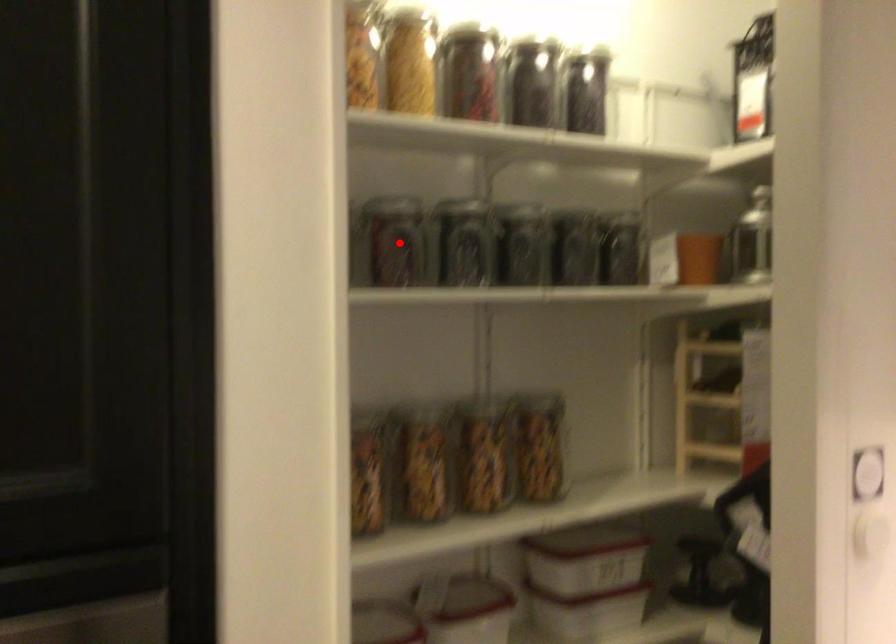
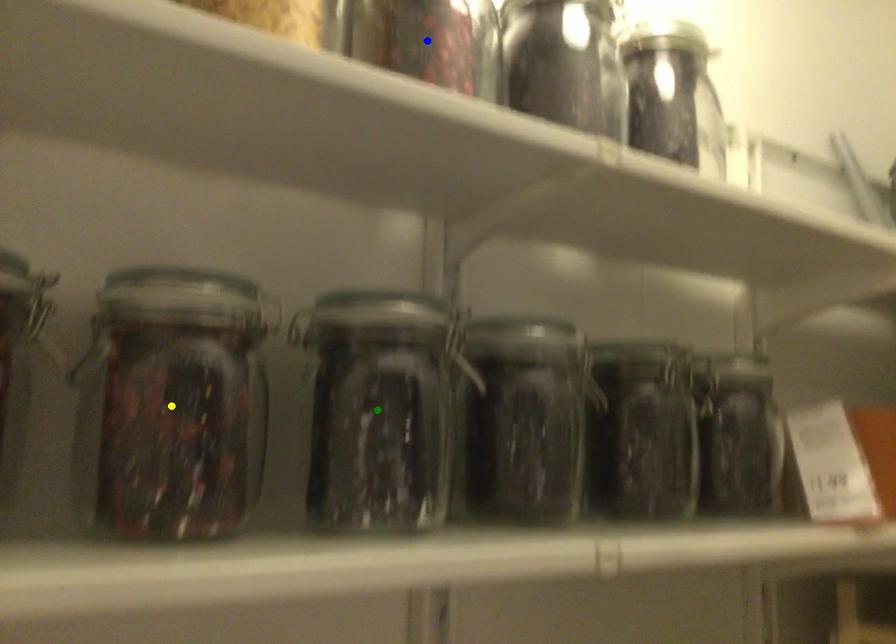
Question: I am providing you with two images of the same scene from different viewpoints. A red point is marked on the first image. You are given multiple points on the second image. In image 2, which mark is for the same physical point as the one in image 1?

Choices:
 (A) yellow point
 (B) blue point
 (C) green point

Answer: (A)